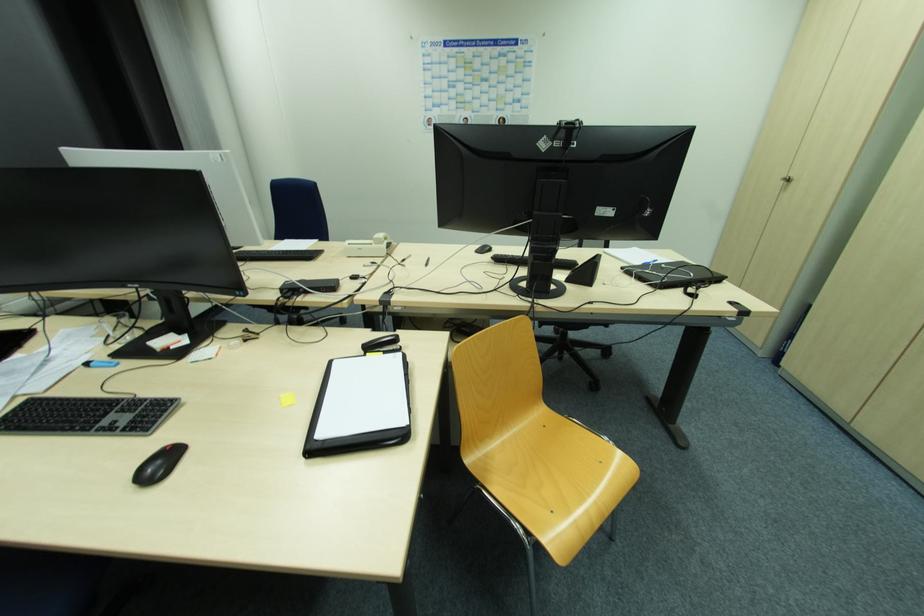
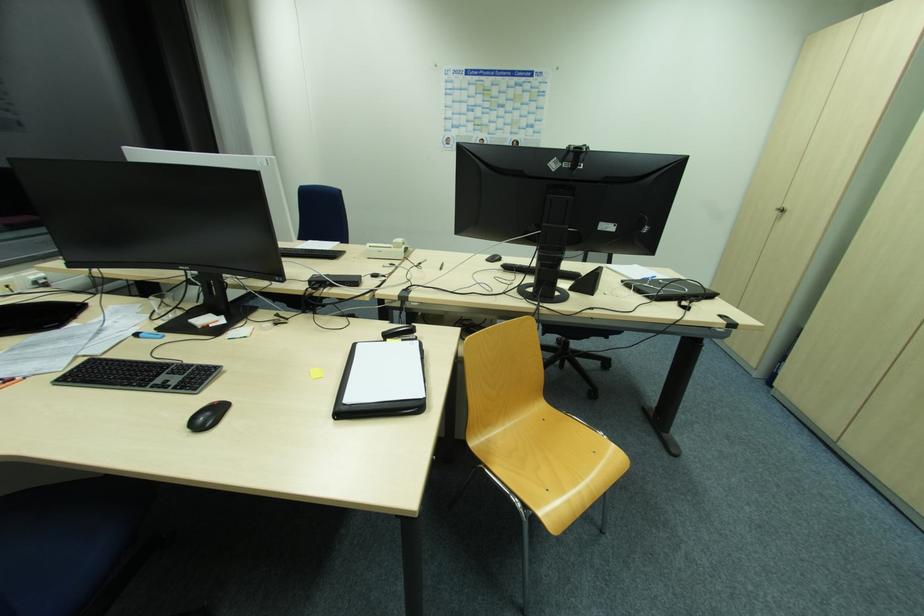
Locate, in the second image, the point that corresponds to point (90, 365) in the first image.

(139, 334)